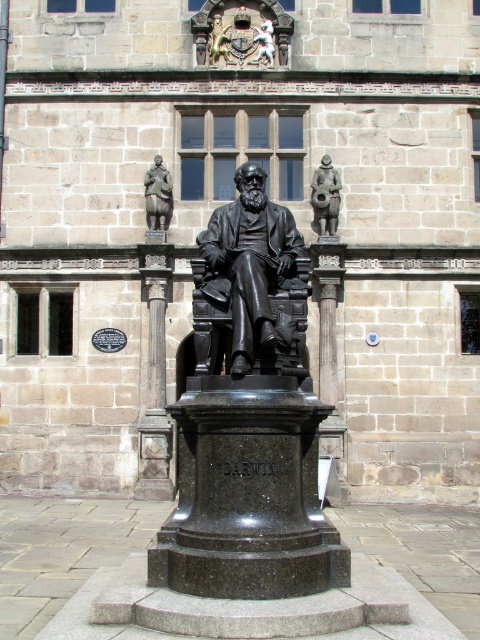
Question: Can you confirm if black polished stone pillar at center is bigger than bronze cannon at center?

Choices:
 (A) yes
 (B) no

Answer: (A)

Question: Which object is positioned closest to the black polished stone pillar at center?

Choices:
 (A) bronze statue at upper center
 (B) black polished statue at center

Answer: (A)

Question: Observing the image, what is the correct spatial positioning of black polished stone pillar at center in reference to bronze statue at upper center?

Choices:
 (A) right
 (B) left

Answer: (B)

Question: Which of these objects is positioned farthest from the bronze statue at upper center?

Choices:
 (A) bronze cannon at center
 (B) black polished stone pillar at center

Answer: (A)

Question: Does bronze cannon at center lie behind bronze statue at upper center?

Choices:
 (A) yes
 (B) no

Answer: (B)

Question: Which object is positioned closest to the bronze cannon at center?

Choices:
 (A) black polished statue at center
 (B) black polished stone pillar at center
 (C) bronze statue at upper center

Answer: (C)